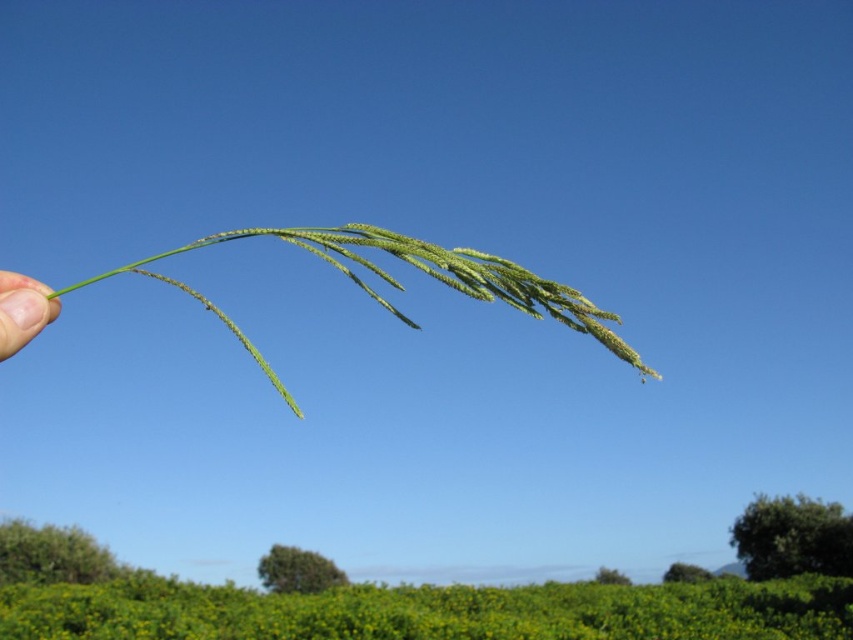
Who is more forward, (206, 243) or (819, 534)?

Point (206, 243)

Can you confirm if green matte grass at center is bigger than green leafy hedge at lower right?

Incorrect, green matte grass at center is not larger than green leafy hedge at lower right.

Which is in front, point (303, 234) or point (788, 538)?

Point (303, 234) is more forward.

I want to click on green matte grass at center, so click(401, 285).

Is green matte grass at center smaller than skinny green stem at left?

Actually, green matte grass at center might be larger than skinny green stem at left.

Does point (357, 276) come in front of point (21, 316)?

No, (357, 276) is behind (21, 316).

The height and width of the screenshot is (640, 853). In order to click on green matte grass at center in this screenshot , I will do tap(401, 285).

Can you confirm if green leafy hedge at lower right is taller than skinny green stem at left?

Indeed, green leafy hedge at lower right has a greater height compared to skinny green stem at left.

Is green leafy hedge at lower right behind skinny green stem at left?

Yes, green leafy hedge at lower right is behind skinny green stem at left.

Who is more distant from viewer, (833, 516) or (10, 282)?

Point (833, 516)

The width and height of the screenshot is (853, 640). Find the location of `green leafy hedge at lower right`. green leafy hedge at lower right is located at coordinates (792, 538).